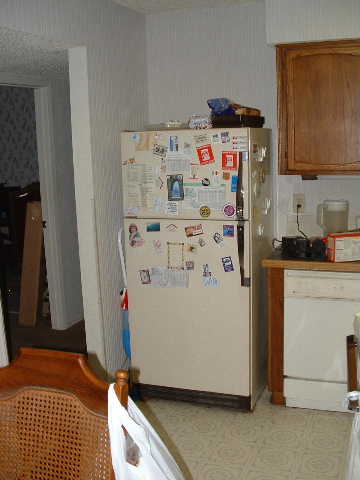
You are a GUI agent. You are given a task and a screenshot of the screen. Output one action in this format:
    pyautogui.click(x=<x>, y=<y>)
    Task: Click on the linoleum kitchen floor
    This screenshot has width=360, height=480.
    Given the screenshot: What is the action you would take?
    pyautogui.click(x=282, y=441)